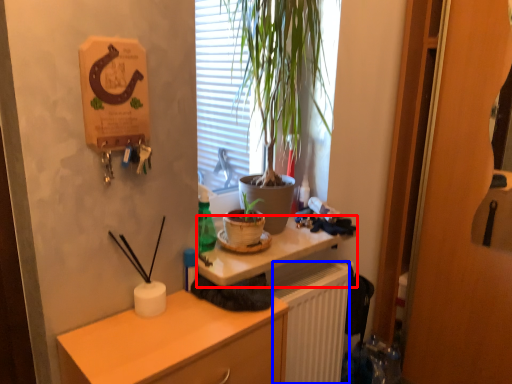
Question: Which object appears farthest to the camera in this image, desk (highlighted by a red box) or radiator (highlighted by a blue box)?

Choices:
 (A) desk
 (B) radiator

Answer: (B)